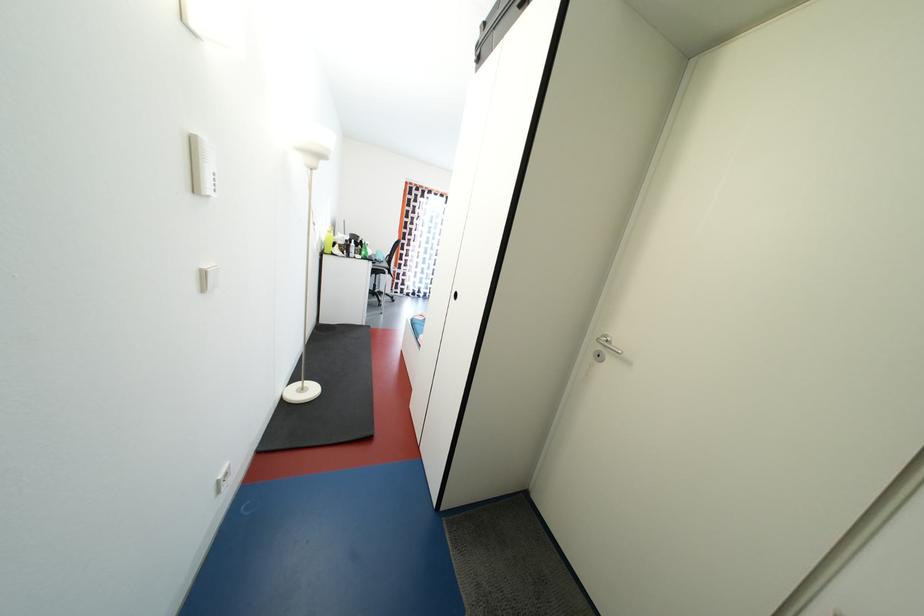
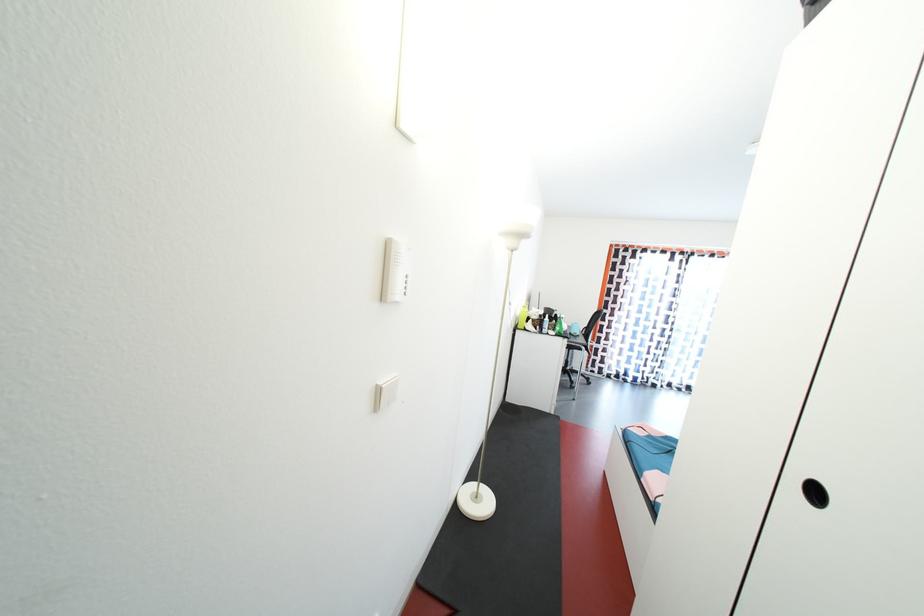
The point at (368, 254) is marked in the first image. Where is the corresponding point in the second image?

(562, 331)